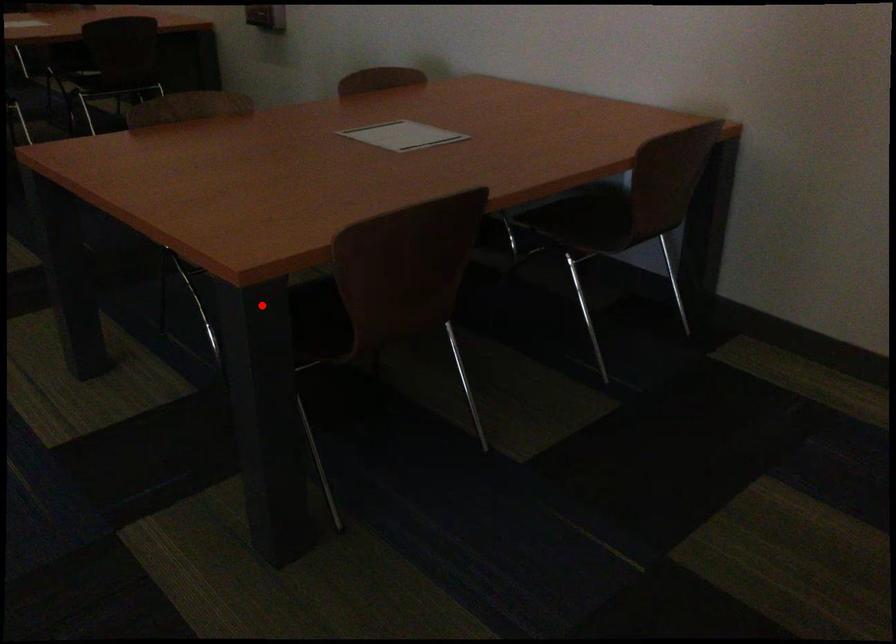
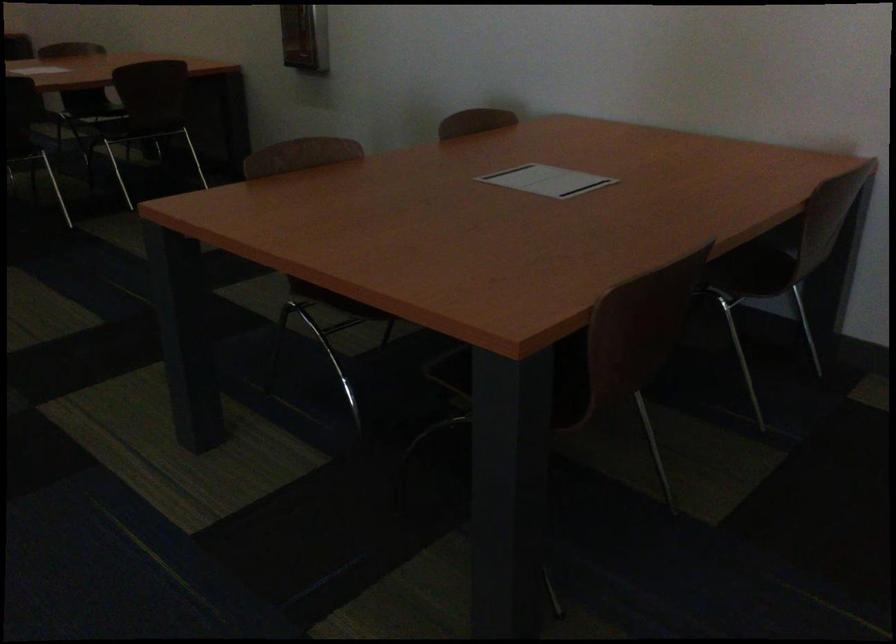
Question: A red point is marked in image1. In image2, is the corresponding 3D point closer to the camera or farther? Reply with the corresponding letter.

Choices:
 (A) The corresponding 3D point is closer.
 (B) The corresponding 3D point is farther.

Answer: (A)